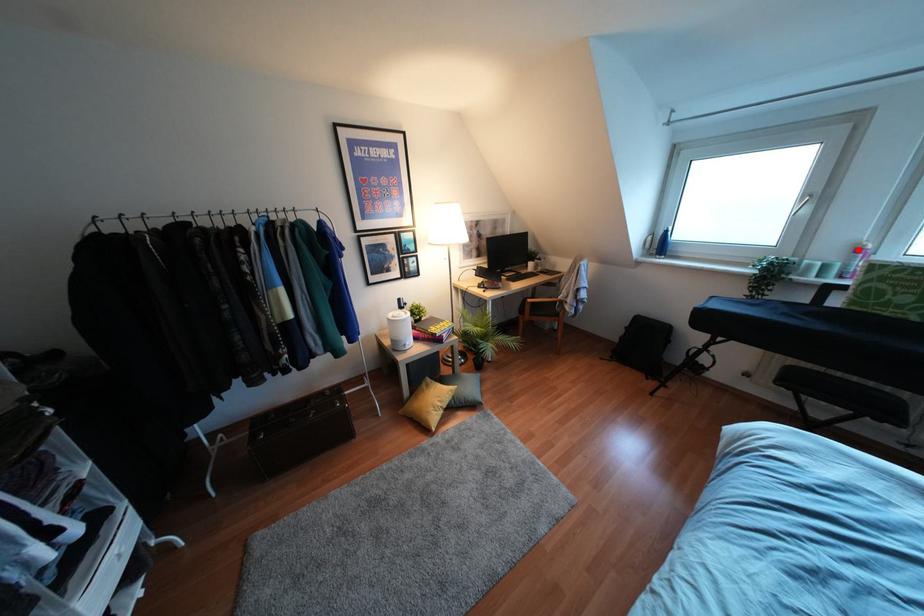
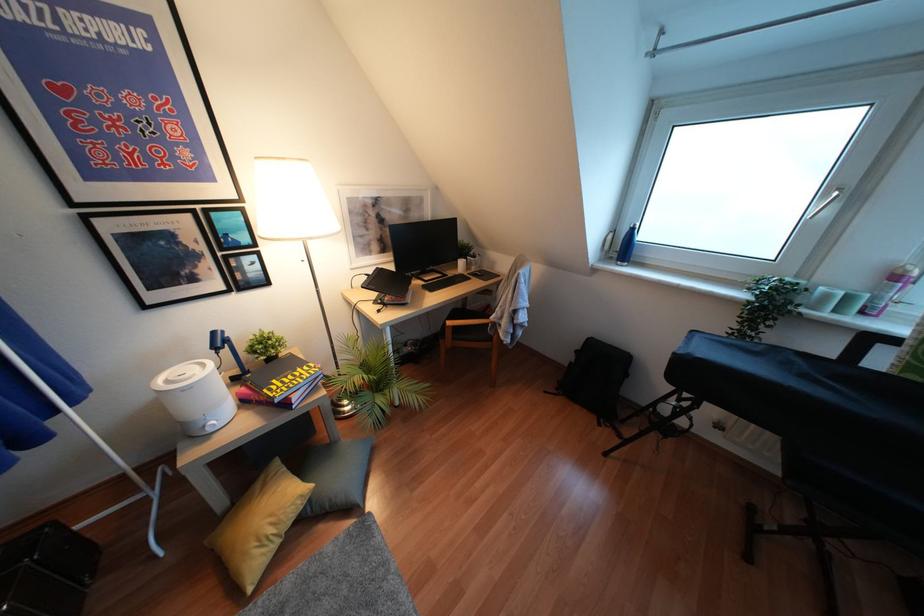
In the second image, find the point that corresponds to the highlighted location in the first image.

(895, 277)